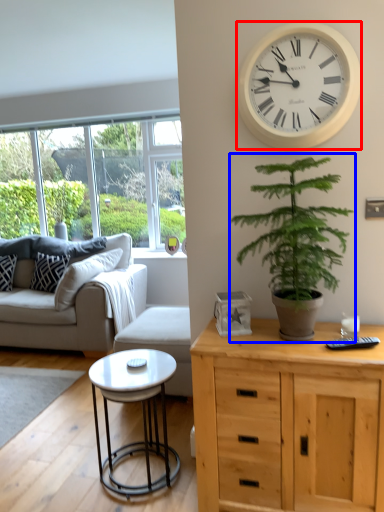
Question: Which point is closer to the camera, wall clock (highlighted by a red box) or houseplant (highlighted by a blue box)?

Choices:
 (A) wall clock
 (B) houseplant

Answer: (B)